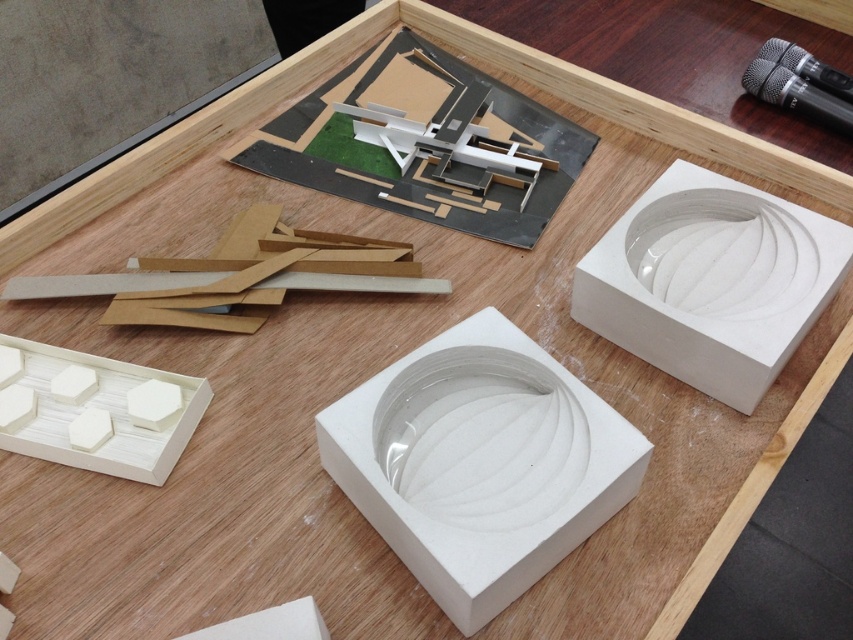
From the picture: You are an architect examining the table layout. You notice two points marked on the table surface at coordinates point [659,188] and point [68,451]. Which point is closer to you as you look at the table?

Point [659,188] is further to the camera than point [68,451], so the point closer to you is point [68,451].